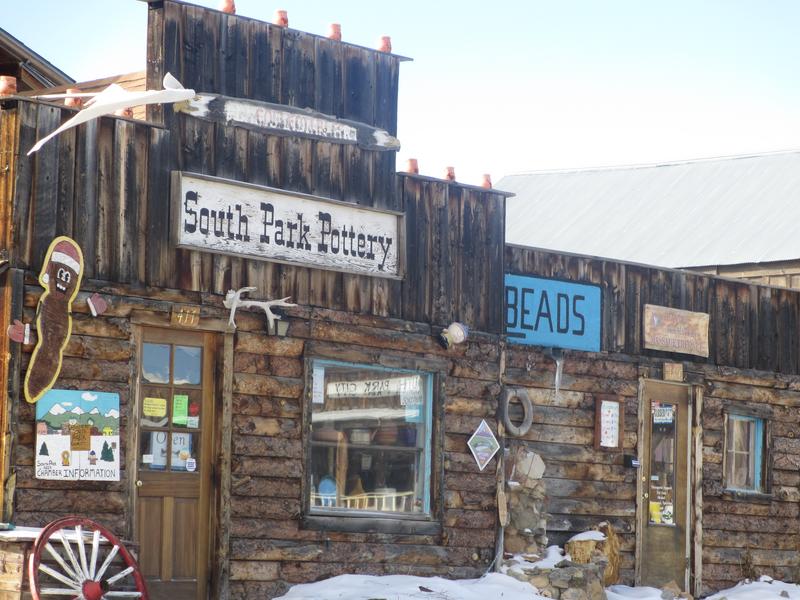
I want to click on pottery, so click(x=346, y=228).